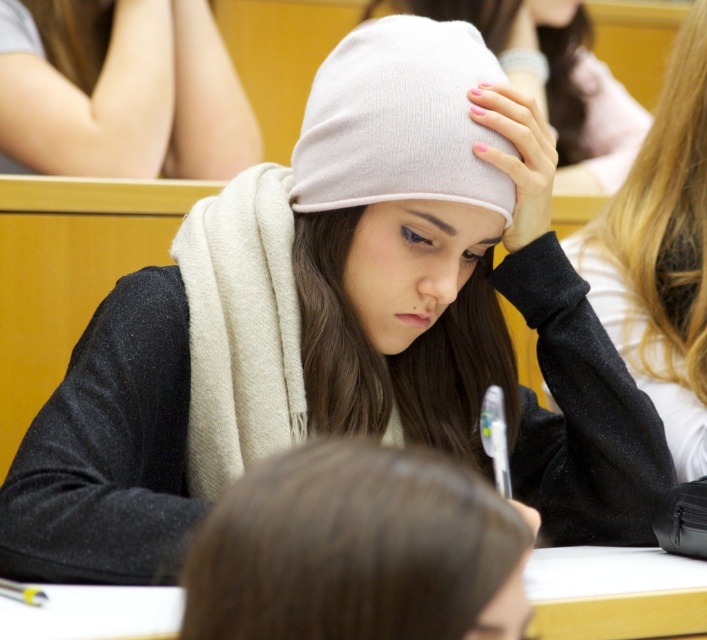
Between smooth beige scarf at upper left and white knit cap at center, which one appears on the left side from the viewer's perspective?

Positioned to the left is smooth beige scarf at upper left.

Locate an element on the screen. The width and height of the screenshot is (707, 640). smooth beige scarf at upper left is located at coordinates (122, 90).

Is point (233, 74) closer to viewer compared to point (491, 227)?

No, (233, 74) is behind (491, 227).

Where is `smooth beige scarf at upper left`? The height and width of the screenshot is (640, 707). smooth beige scarf at upper left is located at coordinates (122, 90).

Who is more forward, (276, 547) or (679, 298)?

Positioned in front is point (276, 547).

Is brown matte hair at center above light beige scarf at upper right?

Incorrect, brown matte hair at center is not positioned above light beige scarf at upper right.

Which is in front, point (274, 486) or point (609, 220)?

Point (274, 486) is more forward.

At what (x,y) coordinates should I click in order to perform the action: click on brown matte hair at center. Please return your answer as a coordinate pair (x, y). Image resolution: width=707 pixels, height=640 pixels. Looking at the image, I should click on (358, 548).

Between smooth beige scarf at upper left and white knit beanie at upper center, which one appears on the left side from the viewer's perspective?

smooth beige scarf at upper left is more to the left.

Can you confirm if smooth beige scarf at upper left is shorter than white knit beanie at upper center?

Yes.

The height and width of the screenshot is (640, 707). What do you see at coordinates (122, 90) in the screenshot? I see `smooth beige scarf at upper left` at bounding box center [122, 90].

Locate an element on the screen. This screenshot has height=640, width=707. smooth beige scarf at upper left is located at coordinates (122, 90).